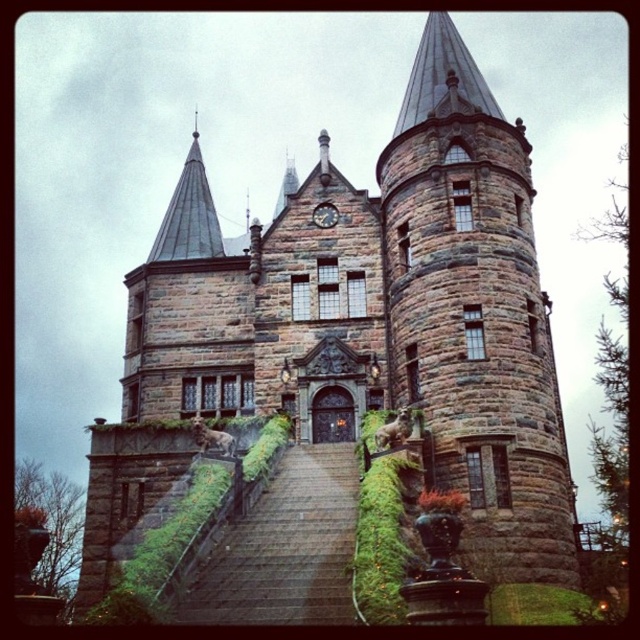
Looking at this image, you are a knight approaching the castle entrance. You need to pass between the brown stone tower at center and the stone stairs at center. Can you fit through the space if your shield is 1.2 meters wide?

The brown stone tower at center might be wider than stone stairs at center, but without exact measurements, it is uncertain whether the 1.2 meter wide shield can fit through the space. Please check the actual width before proceeding.